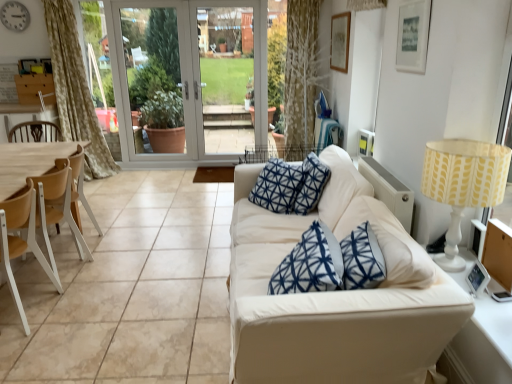
Question: Can you confirm if white fabric couch at center is shorter than silver metallic clock at upper left?

Choices:
 (A) no
 (B) yes

Answer: (A)

Question: Is white fabric couch at center positioned with its back to silver metallic clock at upper left?

Choices:
 (A) yes
 (B) no

Answer: (B)

Question: Is white fabric couch at center not within silver metallic clock at upper left?

Choices:
 (A) yes
 (B) no

Answer: (A)

Question: Can you confirm if white fabric couch at center is smaller than silver metallic clock at upper left?

Choices:
 (A) yes
 (B) no

Answer: (B)

Question: From a real-world perspective, is white fabric couch at center physically below silver metallic clock at upper left?

Choices:
 (A) yes
 (B) no

Answer: (A)

Question: Does white fabric couch at center turn towards silver metallic clock at upper left?

Choices:
 (A) no
 (B) yes

Answer: (A)

Question: Does white glass screen door at center, the 2th screen door when ordered from right to left, have a lesser width compared to light wood/woodenchair at left, arranged as the 1th chair when viewed from the back?

Choices:
 (A) yes
 (B) no

Answer: (A)

Question: From the image's perspective, is white glass screen door at center, the 2th screen door when ordered from right to left, located above light wood/woodenchair at left, arranged as the 1th chair when viewed from the back?

Choices:
 (A) yes
 (B) no

Answer: (A)

Question: Can you confirm if white glass screen door at center, positioned as the first screen door in left-to-right order, is wider than light wood/woodenchair at left, arranged as the 1th chair when viewed from the back?

Choices:
 (A) no
 (B) yes

Answer: (A)

Question: Can you confirm if white glass screen door at center, positioned as the first screen door in left-to-right order, is positioned to the right of light wood/woodenchair at left, arranged as the 1th chair when viewed from the back?

Choices:
 (A) no
 (B) yes

Answer: (B)

Question: Is the depth of white glass screen door at center, positioned as the first screen door in left-to-right order, greater than that of light wood/woodenchair at left, arranged as the 2th chair when viewed from the front?

Choices:
 (A) no
 (B) yes

Answer: (B)

Question: Does white glass screen door at center, positioned as the first screen door in left-to-right order, appear on the left side of light wood/woodenchair at left, arranged as the 1th chair when viewed from the back?

Choices:
 (A) no
 (B) yes

Answer: (A)

Question: From the image's perspective, is silver metallic clock at upper left on top of light brown wood armchair at left?

Choices:
 (A) yes
 (B) no

Answer: (A)